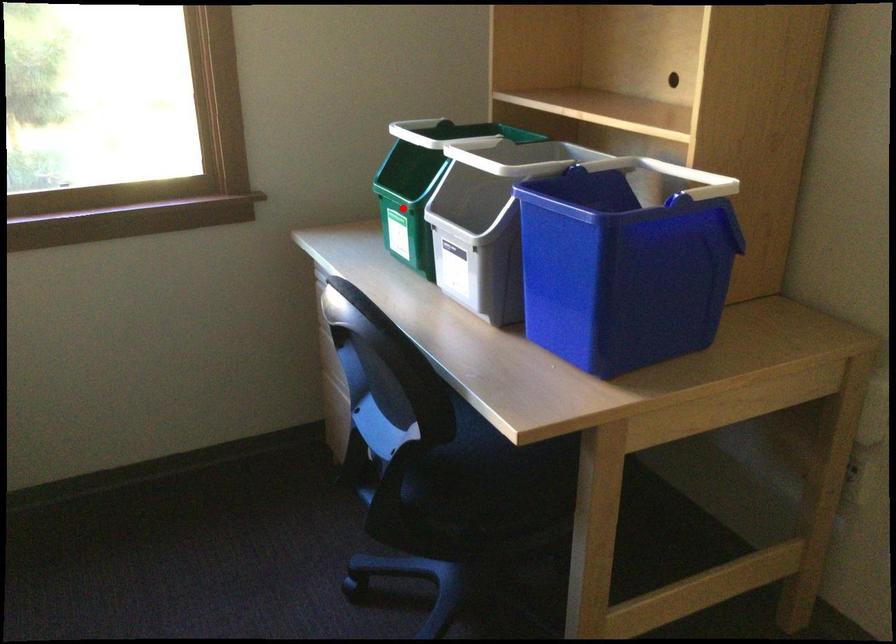
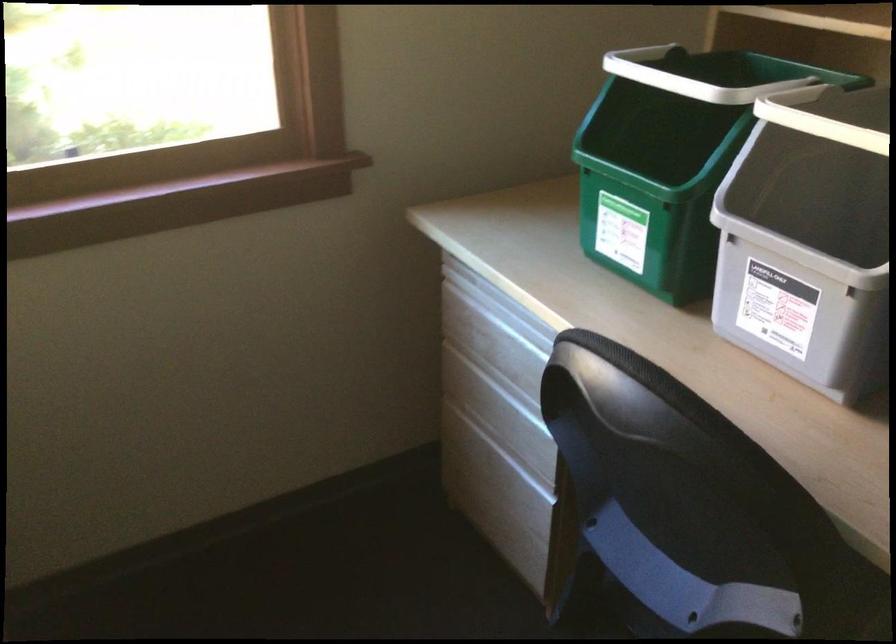
The point at the highlighted location is marked in the first image. Where is the corresponding point in the second image?

(652, 194)